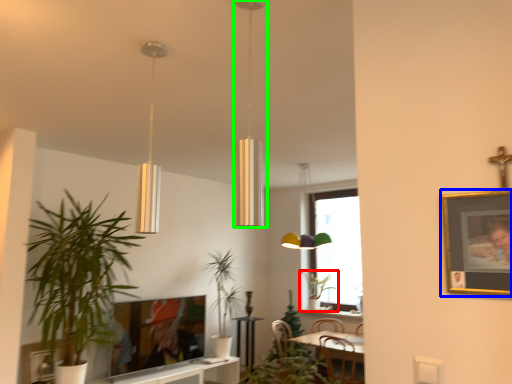
Question: Estimate the real-world distances between objects in this image. Which object is closer to houseplant (highlighted by a red box), picture frame (highlighted by a blue box) or lamp (highlighted by a green box)?

Choices:
 (A) picture frame
 (B) lamp

Answer: (B)